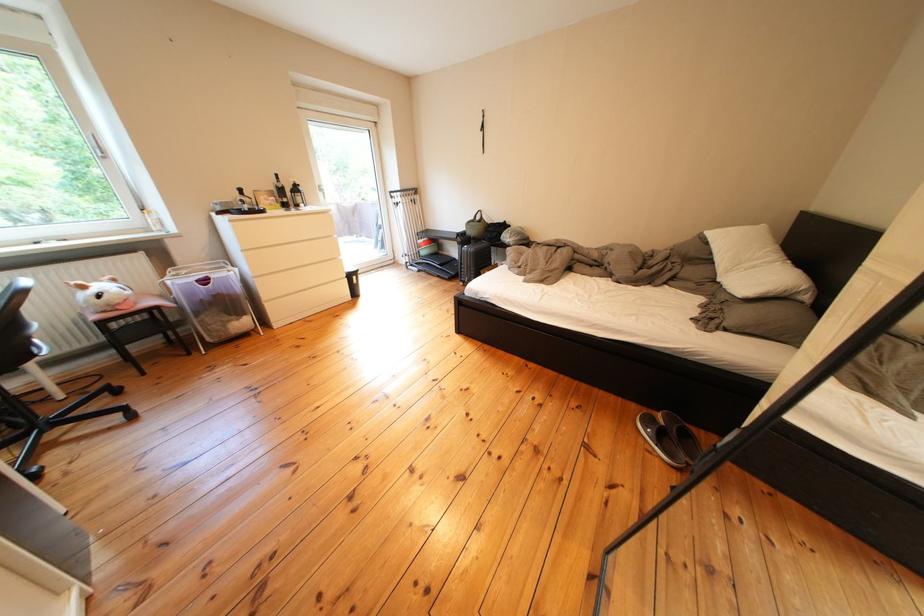
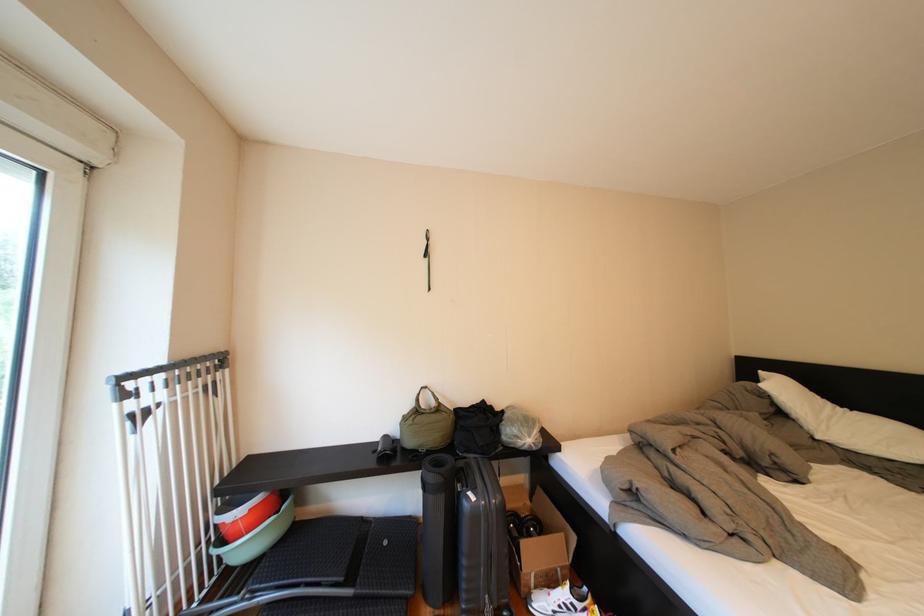
In the second image, find the point that corresponds to point (427, 197) in the first image.

(224, 369)